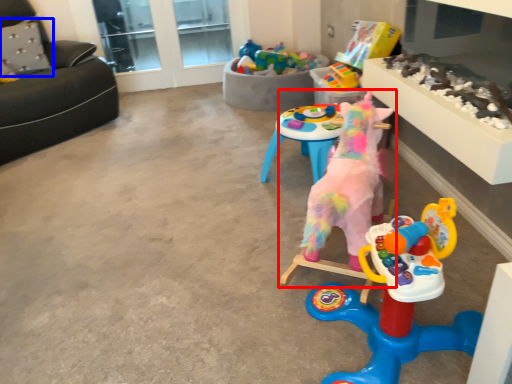
Question: Which point is closer to the camera, toy (highlighted by a red box) or pillow (highlighted by a blue box)?

Choices:
 (A) toy
 (B) pillow

Answer: (A)